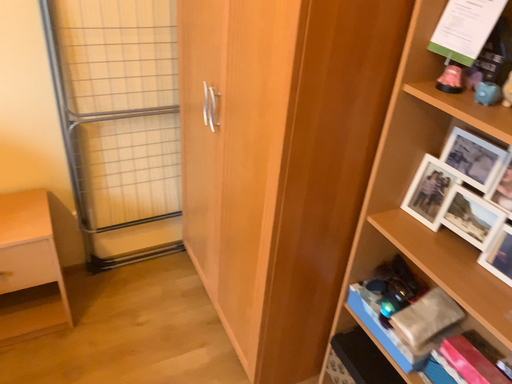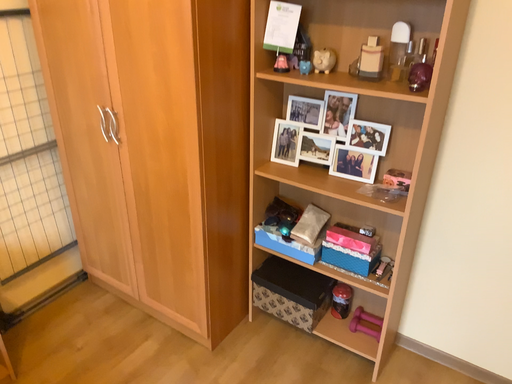
Question: How did the camera likely rotate when shooting the video?

Choices:
 (A) rotated left
 (B) rotated right

Answer: (B)